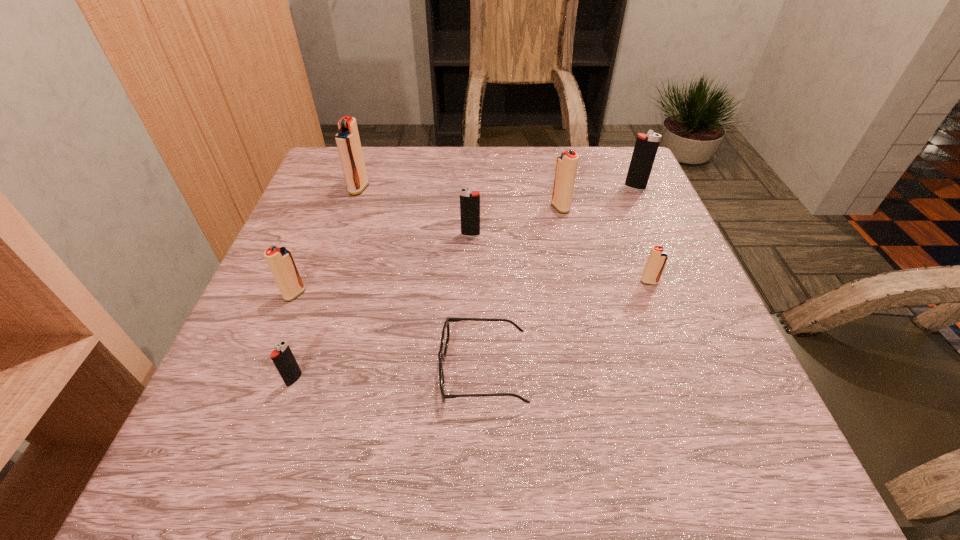
Find the location of a particular element. Image resolution: width=960 pixels, height=540 pixels. vacant space located 0.070m on the back of the rightmost red igniter is located at coordinates (638, 254).

Where is `free space located 0.120m on the back of the smallest black igniter`? free space located 0.120m on the back of the smallest black igniter is located at coordinates (316, 316).

Where is `free space located on the front-facing side of the shortest object`? The image size is (960, 540). free space located on the front-facing side of the shortest object is located at coordinates (361, 370).

The image size is (960, 540). I want to click on vacant space located on the front-facing side of the shortest object, so click(221, 370).

Locate an element on the screen. This screenshot has width=960, height=540. vacant space situated on the front-facing side of the shortest object is located at coordinates (232, 370).

You are a GUI agent. You are given a task and a screenshot of the screen. Output one action in this format:
    pyautogui.click(x=<x>, y=<y>)
    Task: Click on the object that is at the far left corner
    Image resolution: width=960 pixels, height=540 pixels.
    Given the screenshot: What is the action you would take?
    pyautogui.click(x=347, y=139)

Locate an element on the screen. object that is at the far right corner is located at coordinates (646, 146).

Identify the location of vacant space at the far edge of the desktop. (547, 166).

Find the location of a particular element. free space at the near edge of the desktop is located at coordinates 532,438.

Locate an element on the screen. This screenshot has width=960, height=540. free space at the left edge is located at coordinates (233, 416).